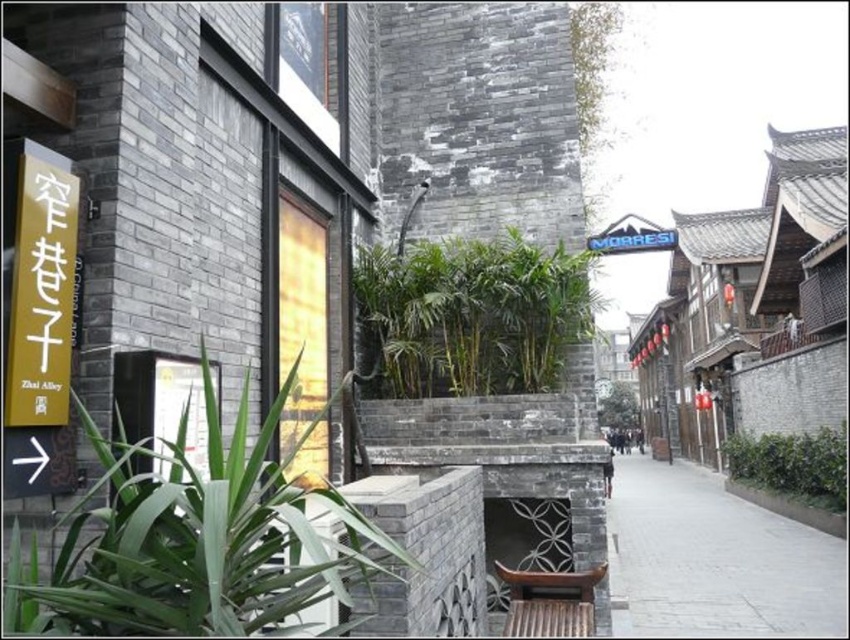
Question: Is green leafy plant at left further to camera compared to gray concrete pavement at lower right?

Choices:
 (A) yes
 (B) no

Answer: (B)

Question: Does green leafy plant at left have a lesser width compared to green leafy plant at center?

Choices:
 (A) no
 (B) yes

Answer: (B)

Question: Which is farther from the gray concrete pavement at lower right?

Choices:
 (A) white plastic sign at upper center
 (B) yellow matte sign at left
 (C) green leafy plant at left
 (D) green leafy plant at center

Answer: (A)

Question: Can you confirm if yellow matte sign at left is smaller than green leafy bush at lower right?

Choices:
 (A) yes
 (B) no

Answer: (A)

Question: Which object is the closest to the gray concrete pavement at lower right?

Choices:
 (A) yellow matte sign at left
 (B) green leafy plant at center
 (C) green leafy plant at left
 (D) white plastic sign at upper center

Answer: (B)

Question: Estimate the real-world distances between objects in this image. Which object is farther from the green leafy plant at left?

Choices:
 (A) yellow matte sign at left
 (B) green leafy bush at lower right

Answer: (B)